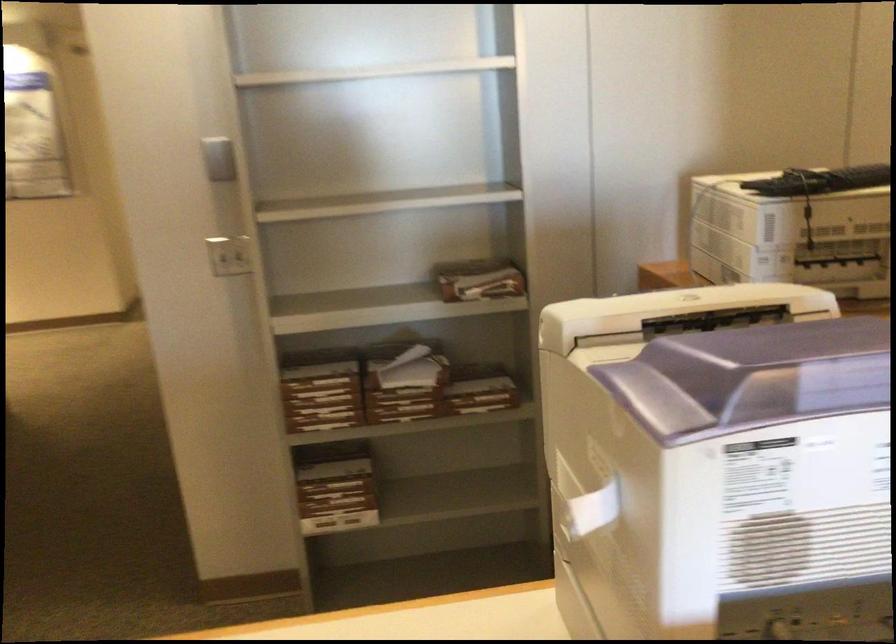
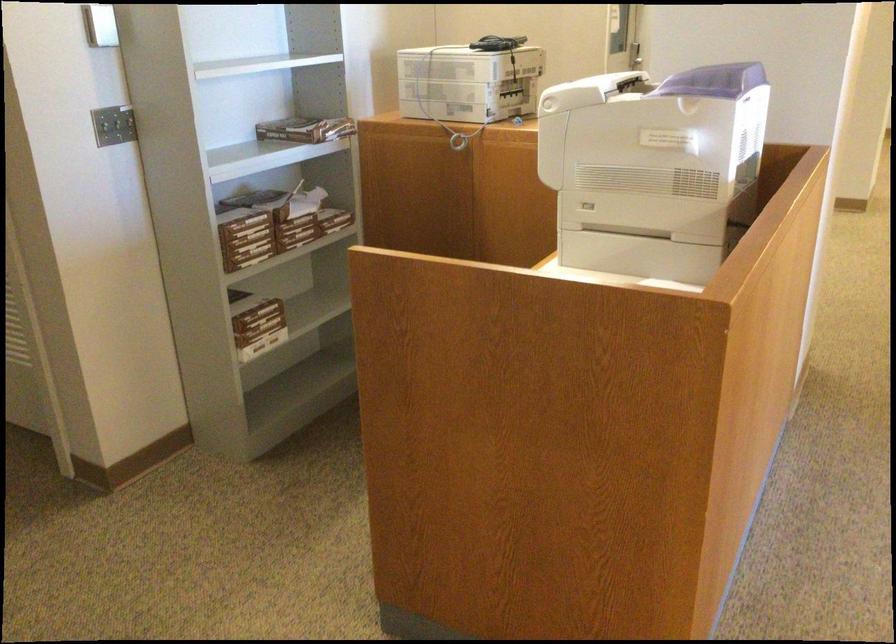
Where in the second image is the point corresponding to the point at 445,287 from the first image?

(306, 129)